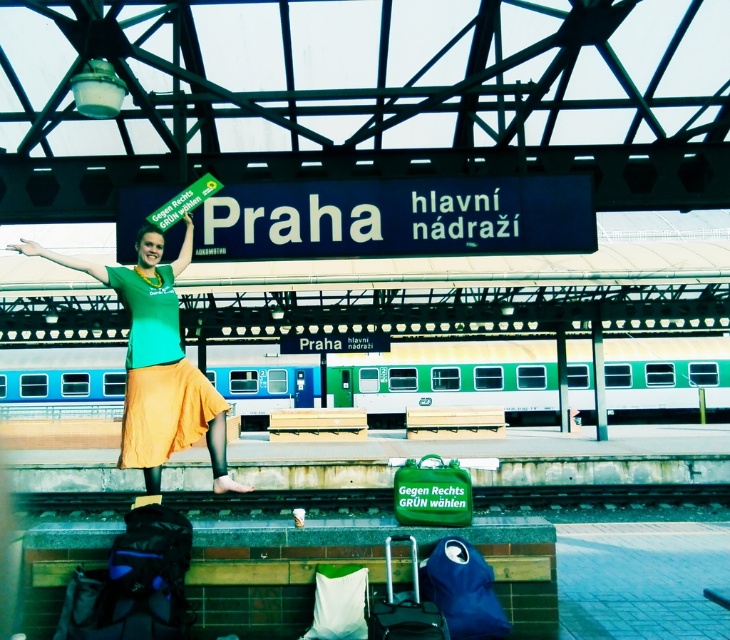
You are a photographer standing at the Prague Main Station platform. You want to take a photo of the matte orange skirt at center and the green metal train track at lower center. Which object will appear closer to the camera in the photo?

The green metal train track at lower center will appear closer to the camera in the photo because the matte orange skirt at center is positioned behind it.